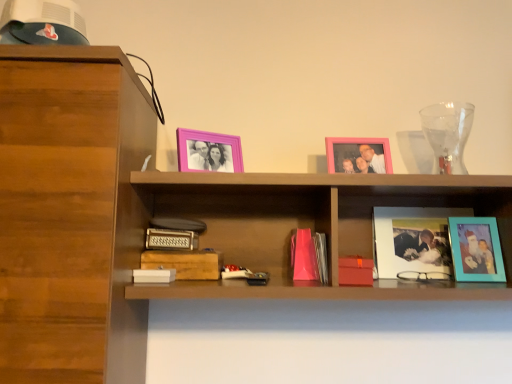
Where is `vacant area on top of wooden paperback book at center, marked as the 3th paperback book in a left-to-right arrangement (from a real-world perspective)`? Image resolution: width=512 pixels, height=384 pixels. vacant area on top of wooden paperback book at center, marked as the 3th paperback book in a left-to-right arrangement (from a real-world perspective) is located at coordinates (182, 248).